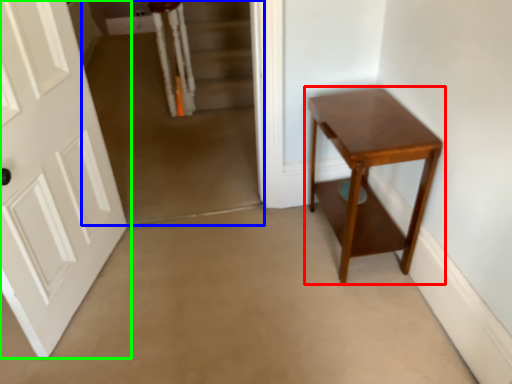
Question: Considering the real-world distances, which object is farthest from table (highlighted by a red box)? corridor (highlighted by a blue box) or door (highlighted by a green box)?

Choices:
 (A) corridor
 (B) door

Answer: (B)